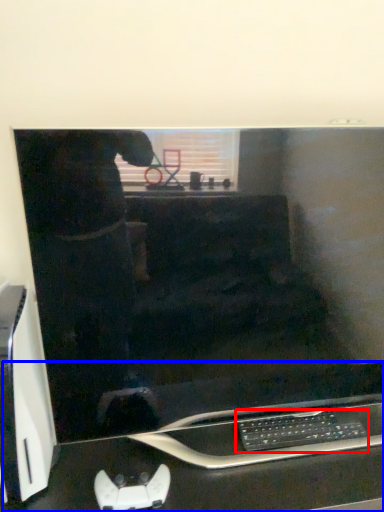
Question: Which object appears farthest to the camera in this image, computer keyboard (highlighted by a red box) or computer desk (highlighted by a blue box)?

Choices:
 (A) computer keyboard
 (B) computer desk

Answer: (A)